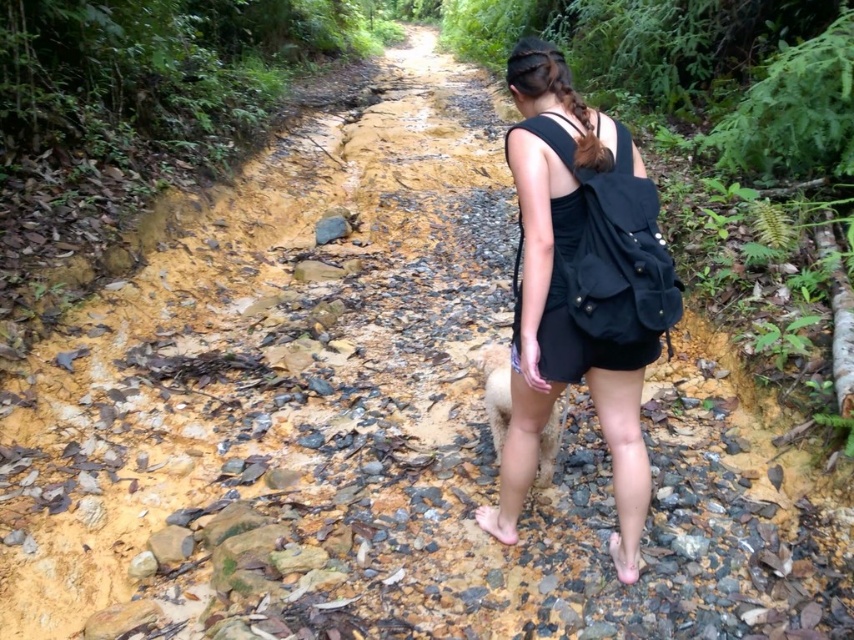
You are a hiker who just started walking on the muddy path. You notice the black fabric backpack at center and the pink fabric sandal at lower center. Which item is closer to your current position?

The black fabric backpack at center is in front of the pink fabric sandal at lower center, so the backpack is closer to your current position.

You are a hiker who just finished a trail and wants to place your gear. You have a black fabric backpack at center and a pink fabric sandal at lower center. If you want to place both items on the ground without moving them, which one is closer to your current position?

The pink fabric sandal at lower center is closer to your current position since it is only 12.50 inches away from the black fabric backpack at center, but without knowing the exact distance from you to each item, we can only compare their positions relative to each other. However, since the sandal is at lower center and the backpack is at center, the sandal is slightly closer to your position.

You are a hiker navigating a muddy, rocky path in a lush forest. You have a black fabric backpack at center. Where is your backpack positioned relative to your current location?

The black fabric backpack at center is located at point [578,280], which means it is positioned slightly to the right and ahead of your current position on the path.